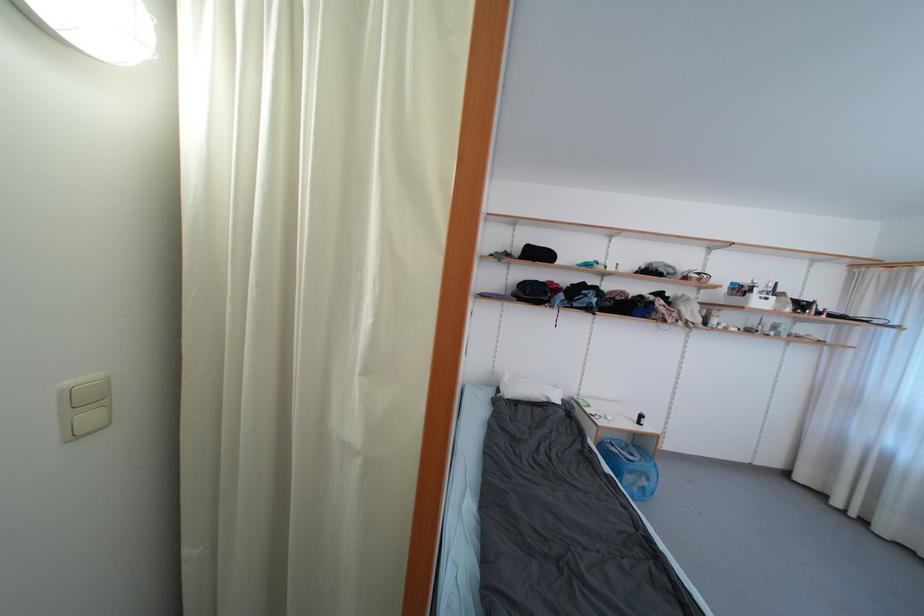
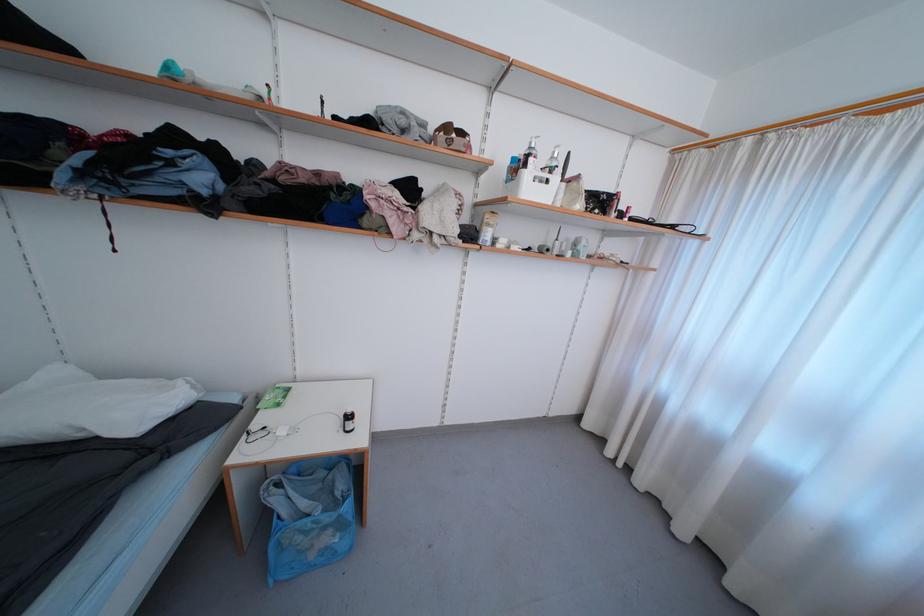
Locate, in the second image, the point that corresponds to the point at 648,424 in the first image.

(354, 429)